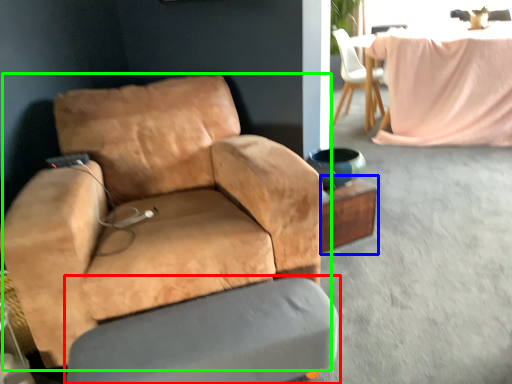
Question: Considering the real-world distances, which object is closest to swivel chair (highlighted by a red box)? side table (highlighted by a blue box) or chair (highlighted by a green box).

Choices:
 (A) side table
 (B) chair

Answer: (B)